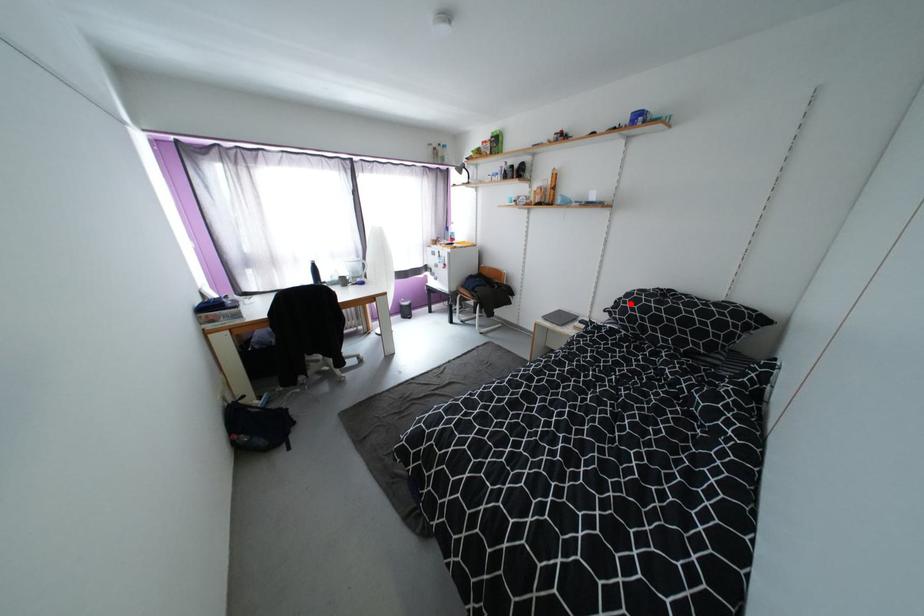
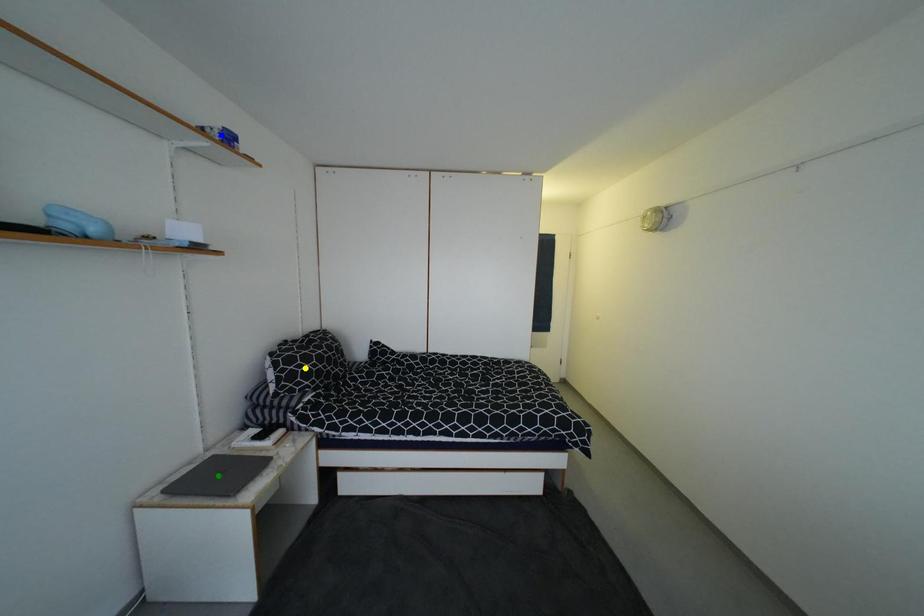
Question: I am providing you with two images of the same scene from different viewpoints. A red point is marked on the first image. You are given multiple points on the second image. Which point in image 2 is actually the same real-world point as the red point in image 1?

Choices:
 (A) blue point
 (B) green point
 (C) yellow point

Answer: (C)